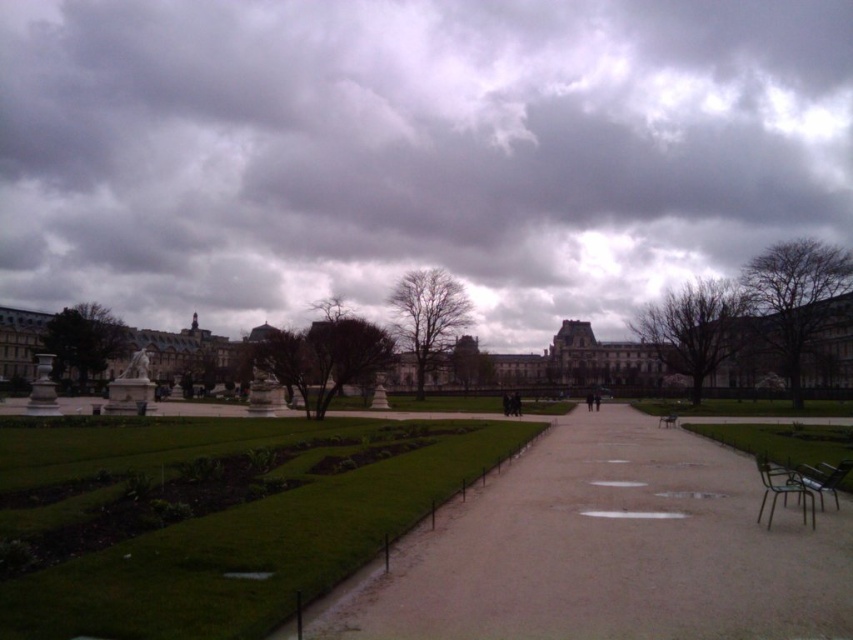
You are planning to walk from one end of the gray concrete pathway at center to the other. Considering the space available, do you think you can walk along the edge of the green grass at center without stepping onto the grass?

The green grass at center is wider than the gray concrete pathway at center. Since the pathway is narrower, you can walk along the edge of the green grass at center without stepping onto the grass as there is enough space on the pathway.

You are standing at the entrance of the plaza and want to walk to the building in the background. Which object, the green grass at center or the gray concrete pathway at center, should you choose to walk on to reach the building?

You should walk on the gray concrete pathway at center because it is above the green grass at center, indicating it is the proper path leading to the building.

You are a delivery person carrying a heavy box and need to walk from the green grass at center to the gray concrete pathway at center. What is the shortest distance you must walk?

The shortest distance you must walk is 11.59 meters between the green grass at center and the gray concrete pathway at center.